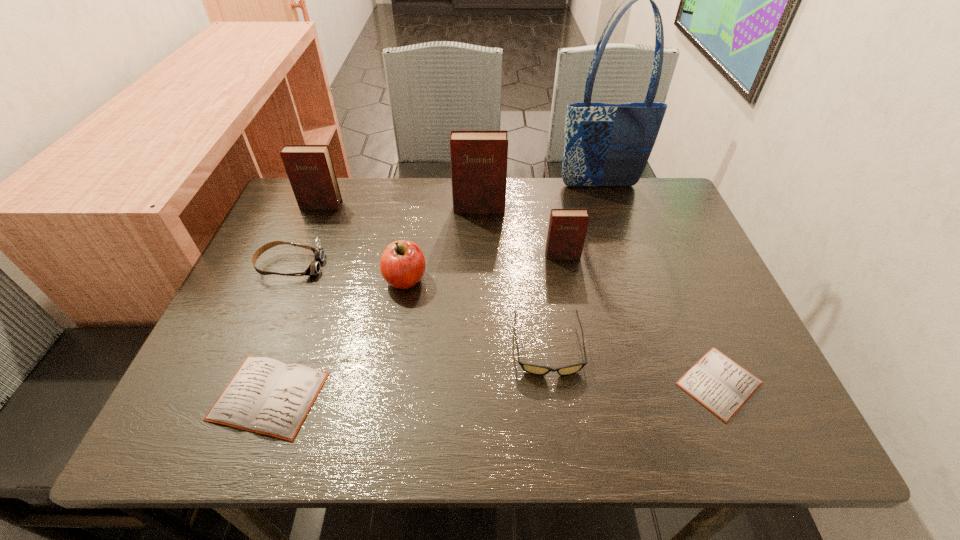
You are a GUI agent. You are given a task and a screenshot of the screen. Output one action in this format:
    pyautogui.click(x=<x>, y=<y>)
    Task: Click on the object at the far left corner
    
    Given the screenshot: What is the action you would take?
    pyautogui.click(x=310, y=170)

Image resolution: width=960 pixels, height=540 pixels. What are the coordinates of `object positioned at the near left corner` in the screenshot? It's located at (266, 396).

Locate an element on the screen. object that is at the far right corner is located at coordinates (605, 144).

What are the coordinates of `object present at the near right corner` in the screenshot? It's located at (721, 385).

This screenshot has width=960, height=540. I want to click on free spot at the far edge of the desktop, so click(374, 197).

The width and height of the screenshot is (960, 540). In the image, there is a desktop. Identify the location of vacant region at the near edge. (588, 407).

This screenshot has width=960, height=540. Find the location of `vacant position at the left edge of the desktop`. vacant position at the left edge of the desktop is located at coordinates (239, 306).

Image resolution: width=960 pixels, height=540 pixels. I want to click on vacant space at the right edge, so click(716, 319).

At what (x,y) coordinates should I click in order to perform the action: click on free space at the near left corner of the desktop. Please return your answer as a coordinate pair (x, y). Image resolution: width=960 pixels, height=540 pixels. Looking at the image, I should click on (168, 441).

In the image, there is a desktop. Find the location of `free space at the far right corner`. free space at the far right corner is located at coordinates (642, 205).